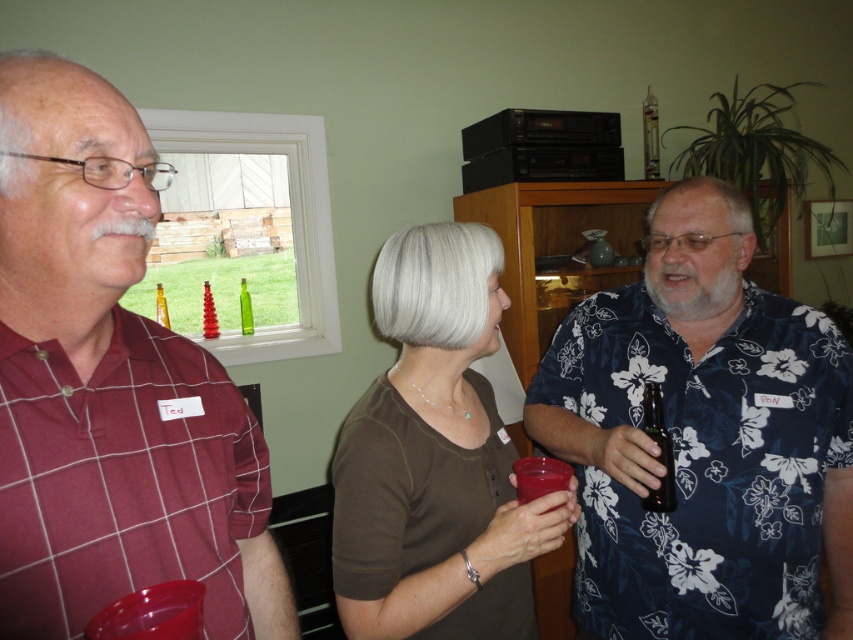
Can you confirm if blue floral shirt at center is wider than translucent glass bottle at center?

Yes, blue floral shirt at center is wider than translucent glass bottle at center.

Consider the image. Can you confirm if blue floral shirt at center is positioned to the left of translucent glass bottle at center?

In fact, blue floral shirt at center is to the right of translucent glass bottle at center.

Measure the distance between blue floral shirt at center and camera.

blue floral shirt at center is 1.10 meters away from camera.

Identify the location of blue floral shirt at center. (703, 440).

Is blue floral shirt at center above translucent glass bottle at left?

No, blue floral shirt at center is not above translucent glass bottle at left.

Who is taller, blue floral shirt at center or translucent glass bottle at left?

Standing taller between the two is blue floral shirt at center.

The width and height of the screenshot is (853, 640). What do you see at coordinates (703, 440) in the screenshot?
I see `blue floral shirt at center` at bounding box center [703, 440].

At what (x,y) coordinates should I click in order to perform the action: click on blue floral shirt at center. Please return your answer as a coordinate pair (x, y). Image resolution: width=853 pixels, height=640 pixels. Looking at the image, I should click on (703, 440).

The width and height of the screenshot is (853, 640). Describe the element at coordinates (650, 136) in the screenshot. I see `clear glass bottle at upper center` at that location.

Is clear glass bottle at upper center thinner than translucent glass bottle at left?

Indeed, clear glass bottle at upper center has a lesser width compared to translucent glass bottle at left.

Which is behind, point (654, 129) or point (158, 317)?

Positioned behind is point (654, 129).

The height and width of the screenshot is (640, 853). Identify the location of clear glass bottle at upper center. (650, 136).